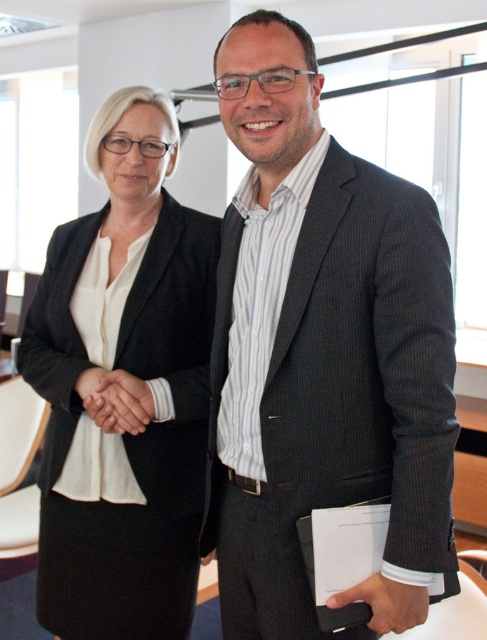
Question: Which object is the closest to the smooth skin handshake at center?

Choices:
 (A) dark gray suit at center
 (B) black leather wallet at lower center
 (C) matte black skirt at lower left

Answer: (C)

Question: Is matte black skirt at lower left closer to camera compared to black leather wallet at lower center?

Choices:
 (A) yes
 (B) no

Answer: (B)

Question: Which point is closer to the camera?

Choices:
 (A) (110, 412)
 (B) (232, 404)
 (C) (348, 595)

Answer: (C)

Question: Can you confirm if dark gray suit at center is bigger than black leather wallet at lower center?

Choices:
 (A) no
 (B) yes

Answer: (B)

Question: Among these points, which one is nearest to the camera?

Choices:
 (A) (391, 625)
 (B) (161, 576)
 (C) (100, 369)

Answer: (A)

Question: Can you confirm if dark gray suit at center is positioned above black leather wallet at lower center?

Choices:
 (A) yes
 (B) no

Answer: (A)